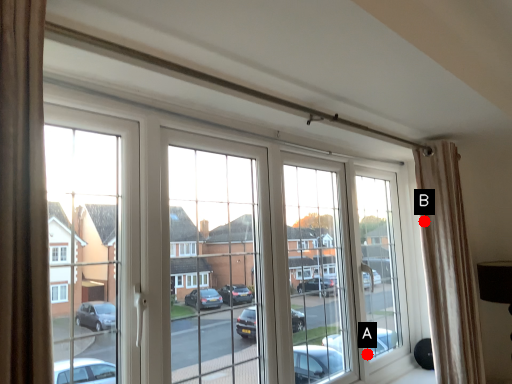
Question: Two points are circled on the image, labeled by A and B beside each circle. Which point is farther to the camera?

Choices:
 (A) A is further
 (B) B is further

Answer: (A)